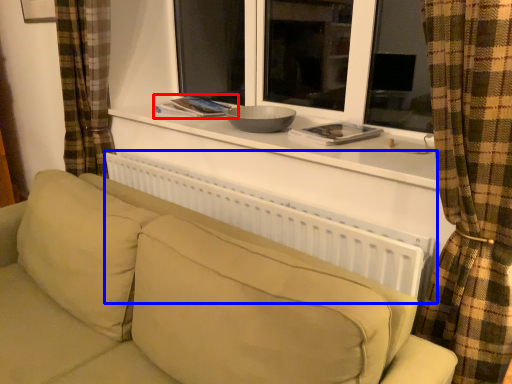
Question: Which object appears closest to the camera in this image, book (highlighted by a red box) or radiator (highlighted by a blue box)?

Choices:
 (A) book
 (B) radiator

Answer: (B)